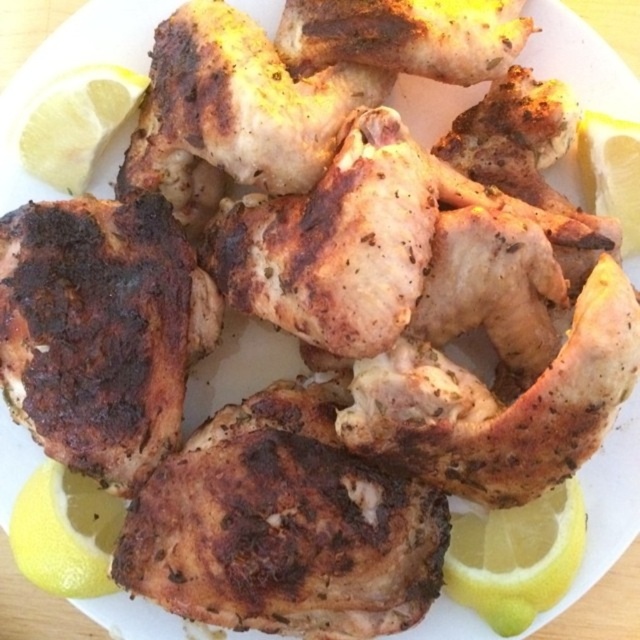
Image resolution: width=640 pixels, height=640 pixels. Describe the element at coordinates (516, 557) in the screenshot. I see `yellow matte lemon at lower right` at that location.

This screenshot has width=640, height=640. What are the coordinates of `yellow matte lemon at lower right` in the screenshot? It's located at (516, 557).

Between point (493, 544) and point (628, 211), which one is positioned behind?

The point (493, 544) is more distant.

Image resolution: width=640 pixels, height=640 pixels. Find the location of `yellow matte lemon at lower right`. yellow matte lemon at lower right is located at coordinates (516, 557).

Which of these two, yellow matte lemon at upper left or yellow matte lemon at right, stands shorter?

Standing shorter between the two is yellow matte lemon at upper left.

Between point (86, 96) and point (628, 122), which one is positioned behind?

The point (86, 96) is more distant.

Find the location of `yellow matte lemon at upper left`. yellow matte lemon at upper left is located at coordinates (76, 124).

Does point (552, 544) come farther from viewer compared to point (38, 573)?

That is True.

Does yellow matte lemon at lower right appear under yellow matte lemon at lower left?

Indeed, yellow matte lemon at lower right is positioned under yellow matte lemon at lower left.

Where is `yellow matte lemon at lower right`? The width and height of the screenshot is (640, 640). yellow matte lemon at lower right is located at coordinates (516, 557).